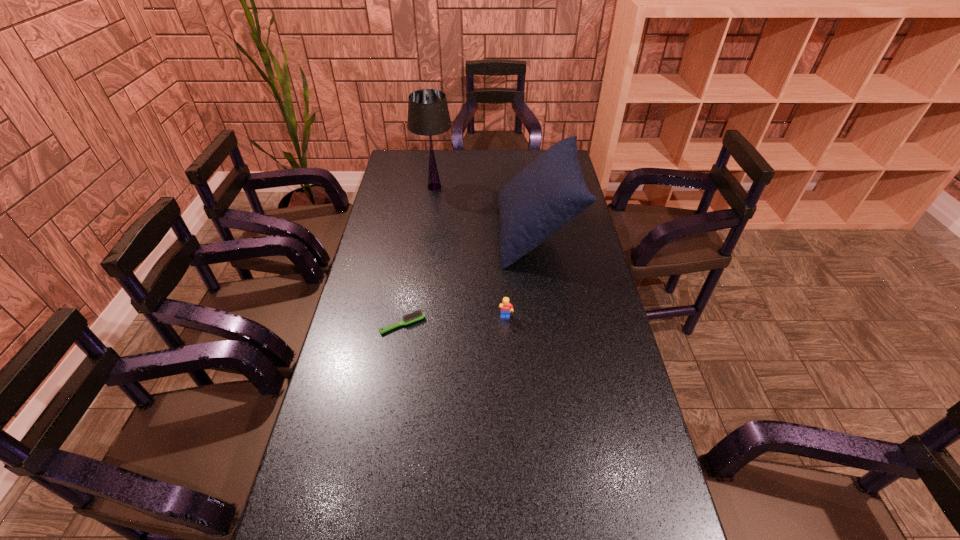
The width and height of the screenshot is (960, 540). Find the location of `the farthest object`. the farthest object is located at coordinates (428, 114).

This screenshot has width=960, height=540. In order to click on the tallest object in this screenshot , I will do `click(428, 114)`.

Where is `the second farthest object`? the second farthest object is located at coordinates point(550,192).

In order to click on the second tallest object in this screenshot , I will do `click(550, 192)`.

Locate an element on the screen. This screenshot has height=540, width=960. Lego is located at coordinates (506, 307).

This screenshot has height=540, width=960. Find the location of `hairbrush`. hairbrush is located at coordinates (418, 315).

You are a GUI agent. You are given a task and a screenshot of the screen. Output one action in this format:
    pyautogui.click(x=<x>, y=<y>)
    Task: Click on the free space located 0.160m on the front-facing side of the lampshade
    The height and width of the screenshot is (540, 960).
    Given the screenshot: What is the action you would take?
    pyautogui.click(x=491, y=187)

The image size is (960, 540). I want to click on vacant space located on the facing side of the third shortest object, so click(x=413, y=233).

The height and width of the screenshot is (540, 960). Identify the location of free space located on the facing side of the third shortest object. (428, 233).

The image size is (960, 540). Find the location of `vacant region located 0.360m on the facing side of the third shortest object`. vacant region located 0.360m on the facing side of the third shortest object is located at coordinates (405, 233).